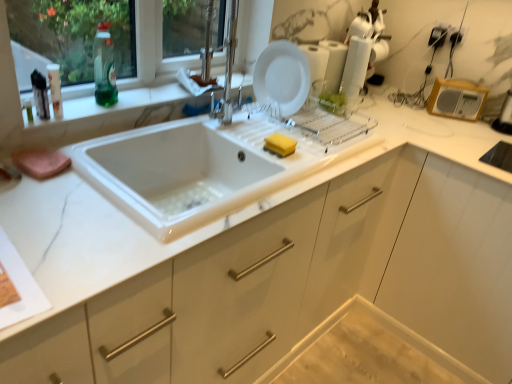
Question: From the image's perspective, would you say wooden radio at upper right, marked as the first appliance in a right-to-left arrangement, is shown under green translucent bottle at upper left, the second bottle from the front?

Choices:
 (A) no
 (B) yes

Answer: (B)

Question: Can you confirm if wooden radio at upper right, marked as the first appliance in a right-to-left arrangement, is smaller than green translucent bottle at upper left, placed as the first bottle when sorted from right to left?

Choices:
 (A) no
 (B) yes

Answer: (A)

Question: Is wooden radio at upper right, placed as the 2th appliance when sorted from left to right, wider than green translucent bottle at upper left, the second bottle from the front?

Choices:
 (A) yes
 (B) no

Answer: (B)

Question: Is wooden radio at upper right, marked as the first appliance in a right-to-left arrangement, positioned before green translucent bottle at upper left, the 1th bottle viewed from the back?

Choices:
 (A) no
 (B) yes

Answer: (A)

Question: Is the position of wooden radio at upper right, placed as the 2th appliance when sorted from left to right, more distant than that of green translucent bottle at upper left, placed as the first bottle when sorted from right to left?

Choices:
 (A) yes
 (B) no

Answer: (A)

Question: Is white matte plate at upper center in front of or behind translucent plastic bottle at upper left, the first bottle from the left, in the image?

Choices:
 (A) behind
 (B) front

Answer: (A)

Question: Is point (263, 82) closer or farther from the camera than point (57, 84)?

Choices:
 (A) closer
 (B) farther

Answer: (B)

Question: From the image's perspective, is white matte plate at upper center above or below translucent plastic bottle at upper left, arranged as the second bottle when viewed from the right?

Choices:
 (A) below
 (B) above

Answer: (B)

Question: In terms of size, does white matte plate at upper center appear bigger or smaller than translucent plastic bottle at upper left, which is the 1th bottle in front-to-back order?

Choices:
 (A) small
 (B) big

Answer: (B)

Question: From the image's perspective, is green translucent bottle at upper left, the 1th bottle viewed from the back, located above or below marble-like white at left?

Choices:
 (A) below
 (B) above

Answer: (B)

Question: Considering the positions of green translucent bottle at upper left, which is the second bottle in left-to-right order, and marble-like white at left in the image, is green translucent bottle at upper left, which is the second bottle in left-to-right order, wider or thinner than marble-like white at left?

Choices:
 (A) wide
 (B) thin

Answer: (B)

Question: In terms of size, does green translucent bottle at upper left, the second bottle from the front, appear bigger or smaller than marble-like white at left?

Choices:
 (A) small
 (B) big

Answer: (A)

Question: From a real-world perspective, is green translucent bottle at upper left, which is the second bottle in left-to-right order, positioned above or below marble-like white at left?

Choices:
 (A) below
 (B) above

Answer: (B)

Question: Which is correct: white glossy plate at upper center, which is the second appliance from right to left, is inside wooden radio at upper right, placed as the 2th appliance when sorted from left to right, or outside of it?

Choices:
 (A) inside
 (B) outside

Answer: (B)

Question: From a real-world perspective, is white glossy plate at upper center, which is the second appliance from right to left, above or below wooden radio at upper right, marked as the first appliance in a right-to-left arrangement?

Choices:
 (A) above
 (B) below

Answer: (A)